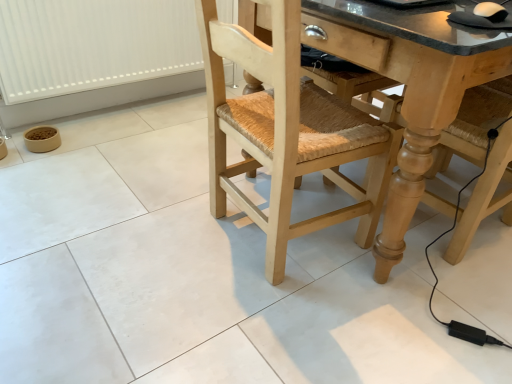
Measure the distance between point (413,210) and camera.

The distance of point (413,210) from camera is 3.86 feet.

Where is `granite countertop at center`? This screenshot has height=384, width=512. granite countertop at center is located at coordinates (406, 91).

Find the location of a particular element. This screenshot has height=384, width=512. natural wood chair at center is located at coordinates (287, 132).

Where is `white plastic radiator at lower left`? This screenshot has height=384, width=512. white plastic radiator at lower left is located at coordinates (92, 44).

Considering the positions of points (148, 8) and (216, 157), is point (148, 8) closer to camera compared to point (216, 157)?

No, it is not.

Identify the location of chair positioned vertically above the white plastic radiator at lower left (from a real-world perspective). This screenshot has width=512, height=384. (287, 132).

From a real-world perspective, is white plastic radiator at lower left under natural wood chair at center?

Yes, from a real-world perspective, white plastic radiator at lower left is under natural wood chair at center.

From the image's perspective, relative to natural wood chair at center, is white plastic radiator at lower left above or below?

white plastic radiator at lower left is above natural wood chair at center.

Is the surface of white plastic radiator at lower left in direct contact with granite countertop at center?

white plastic radiator at lower left and granite countertop at center are not in contact.

Which object is positioned more to the left, white plastic radiator at lower left or granite countertop at center?

From the viewer's perspective, white plastic radiator at lower left appears more on the left side.

Looking at this image, can you tell me how much white plastic radiator at lower left and granite countertop at center differ in facing direction?

There is a 90.2-degree angle between the facing directions of white plastic radiator at lower left and granite countertop at center.

Which is behind, granite countertop at center or natural wood chair at center?

granite countertop at center is more distant.

The image size is (512, 384). Find the location of `chair that is on the left side of granite countertop at center`. chair that is on the left side of granite countertop at center is located at coordinates (287, 132).

From the image's perspective, is granite countertop at center located above or below natural wood chair at center?

Based on their image positions, granite countertop at center is located above natural wood chair at center.

Between granite countertop at center and natural wood chair at center, which one appears on the left side from the viewer's perspective?

natural wood chair at center.

From the image's perspective, is granite countertop at center above or below white plastic radiator at lower left?

granite countertop at center is below white plastic radiator at lower left.

From a real-world perspective, is granite countertop at center physically located above or below white plastic radiator at lower left?

From a real-world perspective, granite countertop at center is physically above white plastic radiator at lower left.

Which of these two, granite countertop at center or white plastic radiator at lower left, stands shorter?

white plastic radiator at lower left is shorter.

From the image's perspective, is natural wood chair at center above or below granite countertop at center?

Clearly, from the image's perspective, natural wood chair at center is below granite countertop at center.

Which object is closer to the camera taking this photo, natural wood chair at center or granite countertop at center?

Positioned in front is natural wood chair at center.

Is natural wood chair at center far from granite countertop at center?

No, natural wood chair at center is not far away from granite countertop at center.

Looking at this image, from a real-world perspective, is natural wood chair at center physically located above or below granite countertop at center?

natural wood chair at center is above granite countertop at center.

Based on the photo, who is smaller, natural wood chair at center or white plastic radiator at lower left?

With smaller size is white plastic radiator at lower left.

Is natural wood chair at center not near white plastic radiator at lower left?

Yes.

Is natural wood chair at center positioned beyond the bounds of white plastic radiator at lower left?

Yes.

Is natural wood chair at center in front of or behind white plastic radiator at lower left in the image?

Visually, natural wood chair at center is located in front of white plastic radiator at lower left.

Locate an element on the screen. radiator that appears on the left of natural wood chair at center is located at coordinates (92, 44).

Find the location of `counter top lying below the white plastic radiator at lower left (from the image's perspective)`. counter top lying below the white plastic radiator at lower left (from the image's perspective) is located at coordinates (406, 91).

Based on their spatial positions, is white plastic radiator at lower left or granite countertop at center further from natural wood chair at center?

white plastic radiator at lower left lies further to natural wood chair at center than the other object.

Looking at the image, which one is located closer to granite countertop at center, white plastic radiator at lower left or natural wood chair at center?

Based on the image, natural wood chair at center appears to be nearer to granite countertop at center.

Which object lies further to the anchor point natural wood chair at center, granite countertop at center or white plastic radiator at lower left?

The object further to natural wood chair at center is white plastic radiator at lower left.

From the image, which object appears to be farther from granite countertop at center, natural wood chair at center or white plastic radiator at lower left?

white plastic radiator at lower left is further to granite countertop at center.

Estimate the real-world distances between objects in this image. Which object is closer to white plastic radiator at lower left, granite countertop at center or natural wood chair at center?

Based on the image, natural wood chair at center appears to be nearer to white plastic radiator at lower left.

When comparing their distances from white plastic radiator at lower left, does natural wood chair at center or granite countertop at center seem closer?

Based on the image, natural wood chair at center appears to be nearer to white plastic radiator at lower left.

I want to click on chair situated between white plastic radiator at lower left and granite countertop at center from left to right, so click(x=287, y=132).